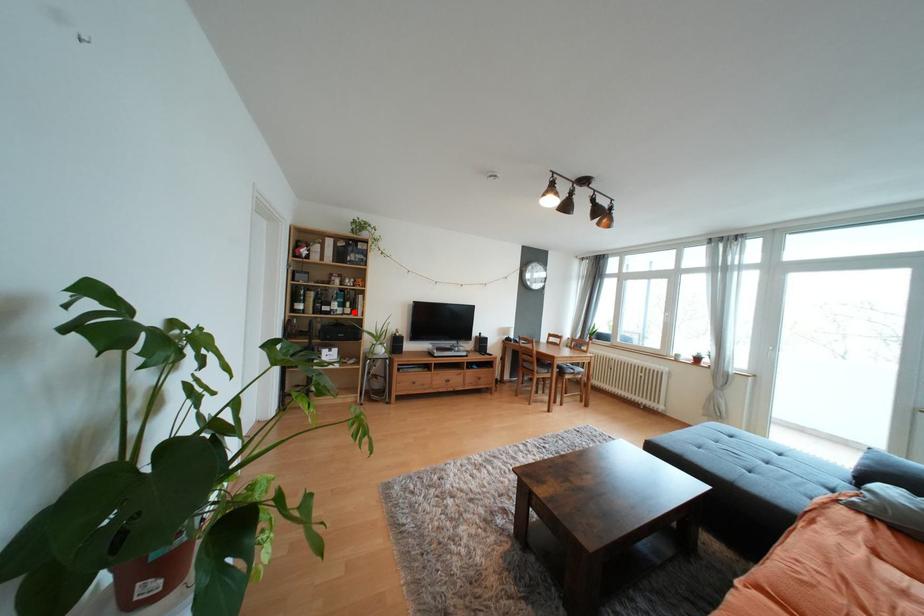
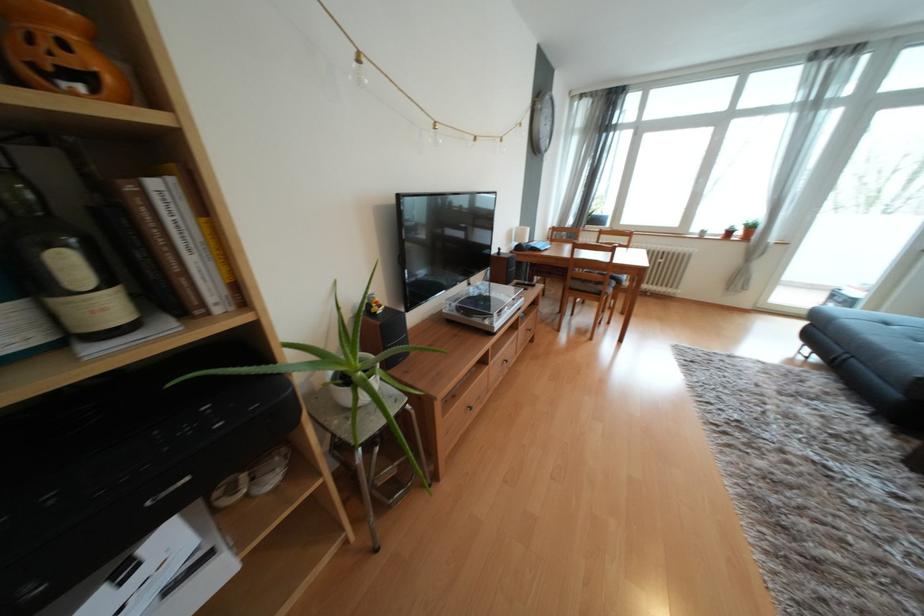
In the second image, find the point that corresponds to the highlighted location in the first image.

(111, 308)